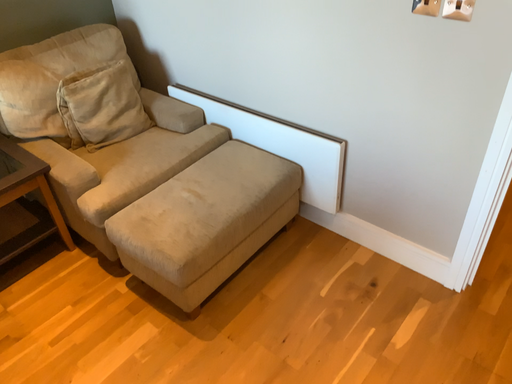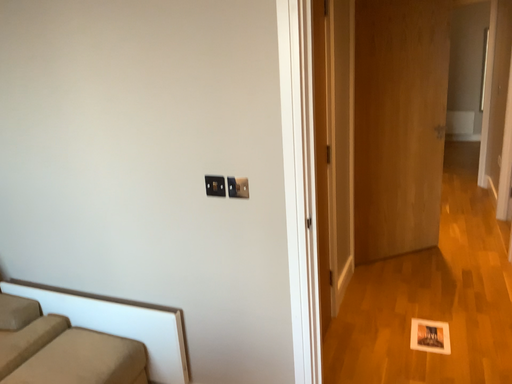
Question: How did the camera likely rotate when shooting the video?

Choices:
 (A) rotated left
 (B) rotated right

Answer: (B)